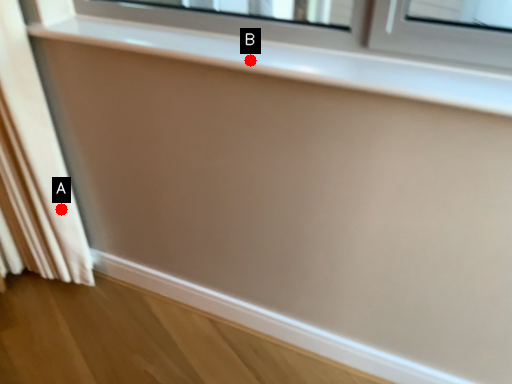
Question: Two points are circled on the image, labeled by A and B beside each circle. Among these points, which one is nearest to the camera?

Choices:
 (A) A is closer
 (B) B is closer

Answer: (B)